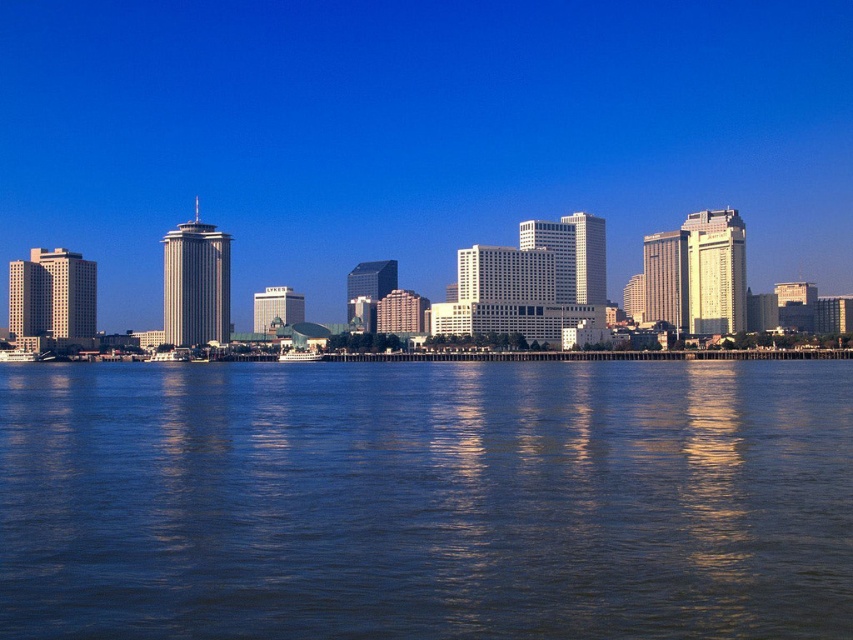
You are a photographer planning to capture the entire skyline in one shot. Given that the blue liquid water at lower center and the transparent glass skyscrapers at center are both in your frame, which object occupies more horizontal space in the photo?

The transparent glass skyscrapers at center occupy more horizontal space in the photo since the blue liquid water at lower center has a lesser width compared to them.

You are a drone operator planning to fly a drone from the blue liquid water at lower center to the transparent glass skyscrapers at center. According to the image, what is the minimum distance the drone must travel in feet?

The blue liquid water at lower center and transparent glass skyscrapers at center are 313.45 feet apart from each other, so the minimum distance the drone must travel is 313.45 feet.

You are standing on a pier and looking at the blue liquid water at lower center. If you want to throw a small stone into the water, will it land within 25 meters from where you are standing?

Answer: The blue liquid water at lower center is 23.54 meters away from the viewer, so yes, throwing a small stone into the water will land within 25 meters from where you are standing since 23.54 meters is less than 25 meters.